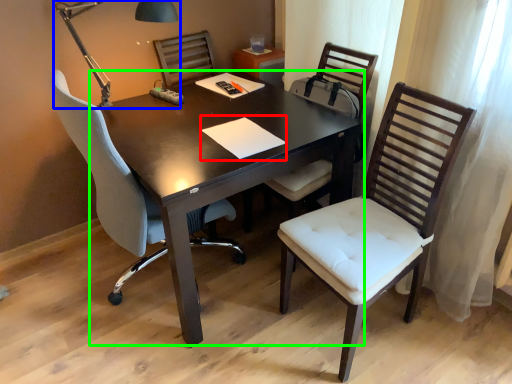
Question: Which object is the closest to the notepad (highlighted by a red box)? Choose among these: table lamp (highlighted by a blue box) or table (highlighted by a green box).

Choices:
 (A) table lamp
 (B) table

Answer: (B)